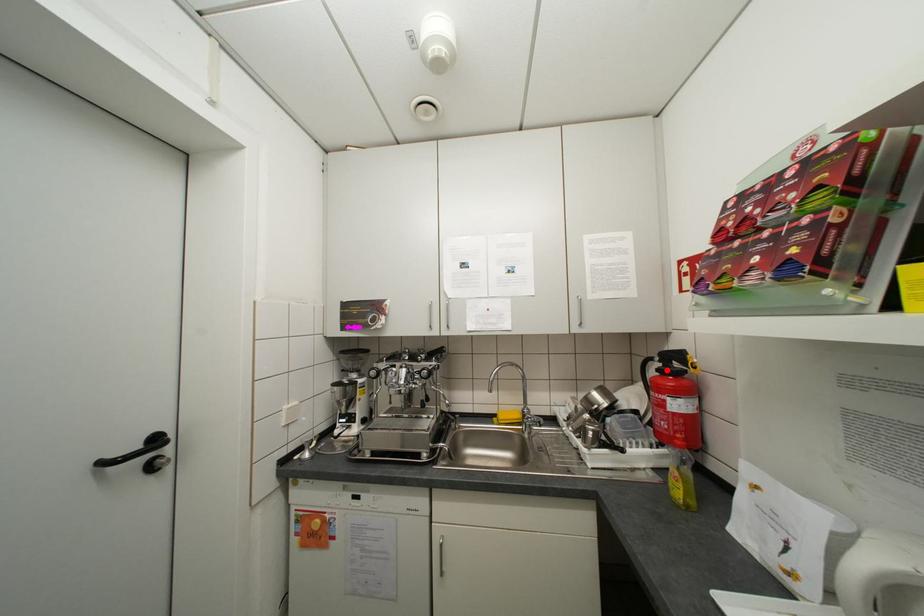
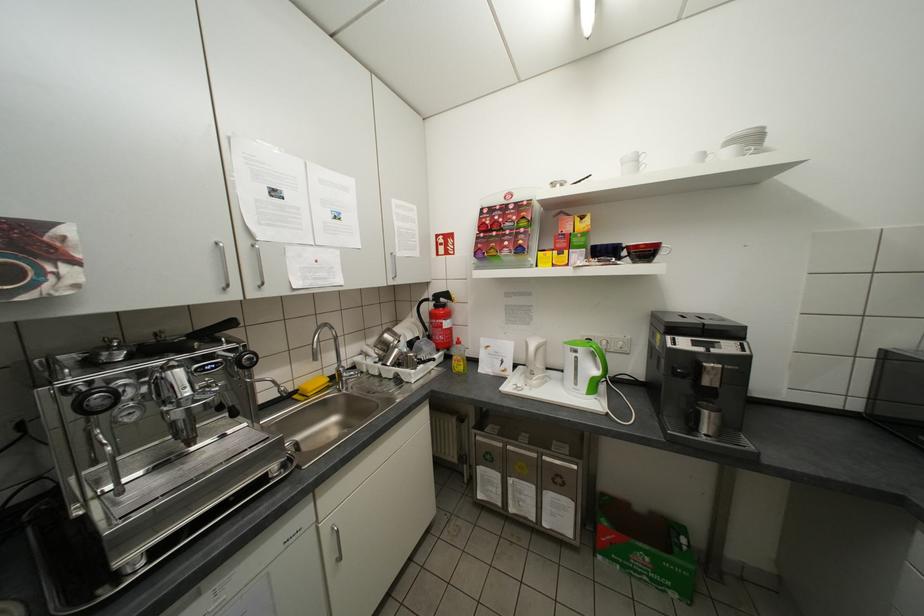
The point at the highlighted location is marked in the first image. Where is the corresponding point in the second image?

(444, 306)